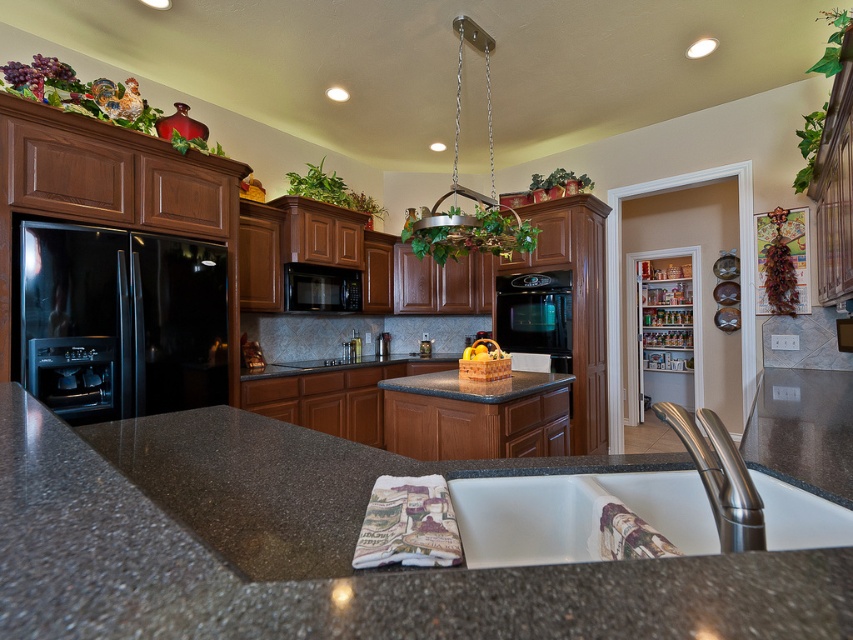
Question: Which of the following is the closest to the observer?

Choices:
 (A) yellow matte bananas at center
 (B) white ceramic sink at lower center
 (C) granite at center
 (D) stainless steel faucet at sink center

Answer: (C)

Question: Does granite at center have a greater width compared to black stainless steel refrigerator at left?

Choices:
 (A) no
 (B) yes

Answer: (B)

Question: Does granite at center have a larger size compared to black stainless steel refrigerator at left?

Choices:
 (A) yes
 (B) no

Answer: (A)

Question: Based on their relative distances, which object is farther from the black matte microwave at center?

Choices:
 (A) yellow matte bananas at center
 (B) black stainless steel refrigerator at left
 (C) stainless steel faucet at sink center
 (D) white ceramic sink at lower center

Answer: (C)

Question: Which object appears farthest from the camera in this image?

Choices:
 (A) black stainless steel refrigerator at left
 (B) yellow matte bananas at center
 (C) white ceramic sink at lower center

Answer: (B)

Question: Does granite at center appear on the left side of stainless steel faucet at sink center?

Choices:
 (A) no
 (B) yes

Answer: (A)